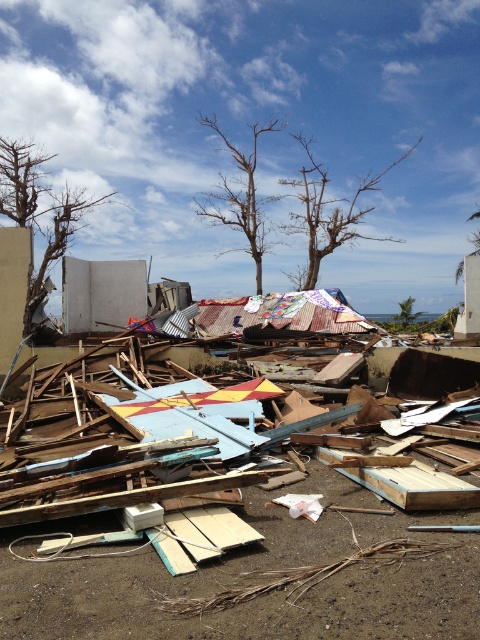
Question: Does bare wood tree at upper center come behind bare wood tree at center?

Choices:
 (A) no
 (B) yes

Answer: (A)

Question: Which of the following is the closest to the observer?

Choices:
 (A) bare wood tree at center
 (B) brown wood tree at upper left
 (C) bare wood tree at upper center

Answer: (B)

Question: Which of the following is the closest to the observer?

Choices:
 (A) green leafy tree at center
 (B) bare branches at center

Answer: (A)

Question: Where is bare wood tree at center located in relation to green leafy tree at center in the image?

Choices:
 (A) left
 (B) right

Answer: (A)

Question: Does brown wood tree at upper left appear under bare wood tree at upper center?

Choices:
 (A) yes
 (B) no

Answer: (A)

Question: Which point is farther from the camera taking this photo?

Choices:
 (A) (219, 252)
 (B) (396, 314)
 (C) (479, 250)

Answer: (C)